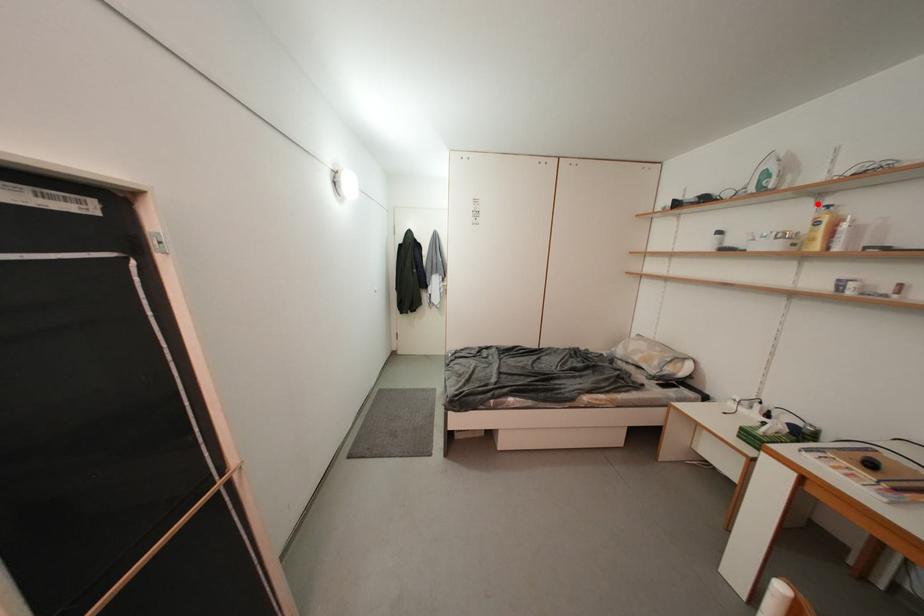
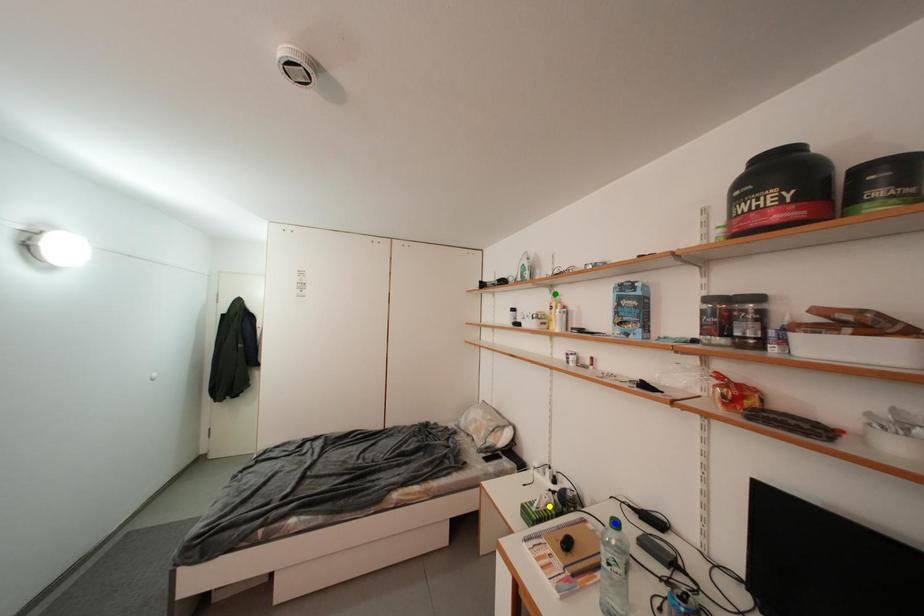
Question: I am providing you with two images of the same scene from different viewpoints. A red point is marked on the first image. You are given multiple points on the second image. Which spot in image 2 lines up with the point in image 1?

Choices:
 (A) green point
 (B) yellow point
 (C) blue point

Answer: (A)